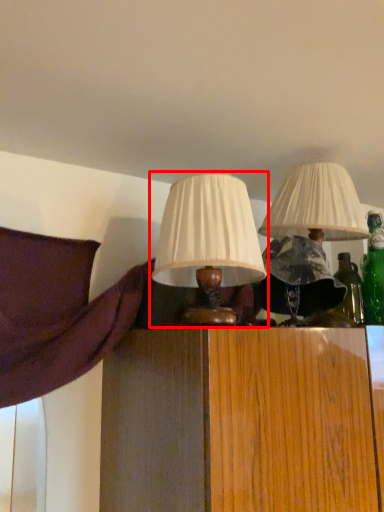
Question: From the image's perspective, where is lamp (annotated by the red box) located relative to lamp?

Choices:
 (A) above
 (B) below

Answer: (B)